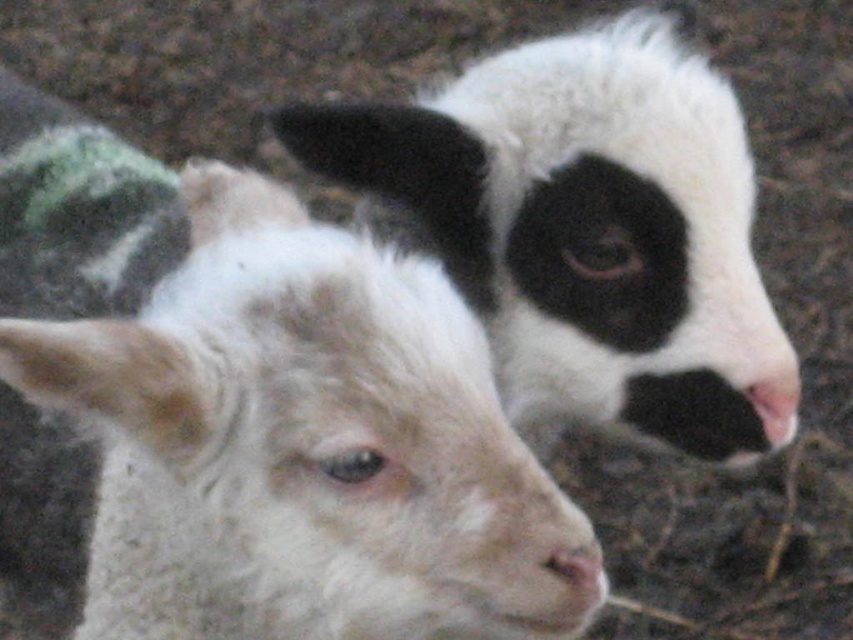
Between white woolen lamb at center and white fluffy goat at upper right, which one has more height?

white fluffy goat at upper right

Who is higher up, white woolen lamb at center or white fluffy goat at upper right?

white fluffy goat at upper right is above.

Between point (374, 413) and point (682, 278), which one is positioned in front?

Positioned in front is point (374, 413).

Identify the location of white woolen lamb at center. (300, 444).

Consider the image. Who is shorter, white fluffy goat at upper right or white soft fur nose at center?

white soft fur nose at center

Measure the distance from white fluffy goat at upper right to white soft fur nose at center.

The distance of white fluffy goat at upper right from white soft fur nose at center is 43.09 centimeters.

Locate an element on the screen. Image resolution: width=853 pixels, height=640 pixels. white fluffy goat at upper right is located at coordinates (589, 230).

This screenshot has width=853, height=640. What are the coordinates of `white fluffy goat at upper right` in the screenshot? It's located at (589, 230).

Is white woolen lamb at center above white soft fur nose at center?

Indeed, white woolen lamb at center is positioned over white soft fur nose at center.

Is point (213, 301) less distant than point (601, 561)?

Yes.

Which is behind, point (219, 516) or point (595, 554)?

The point (219, 516) is behind.

Locate an element on the screen. white woolen lamb at center is located at coordinates (300, 444).